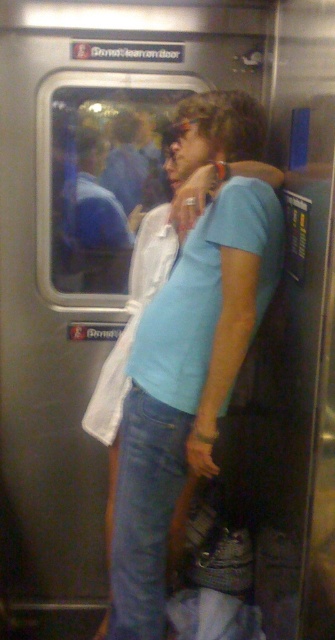
Question: Does light blue t-shirt at center lie behind blue shirt at center?

Choices:
 (A) no
 (B) yes

Answer: (A)

Question: Can you confirm if light blue t-shirt at center is smaller than blue shirt at center?

Choices:
 (A) yes
 (B) no

Answer: (B)

Question: Does light blue t-shirt at center have a larger size compared to blue shirt at center?

Choices:
 (A) yes
 (B) no

Answer: (A)

Question: Which point appears farthest from the camera in this image?

Choices:
 (A) (213, 132)
 (B) (98, 147)

Answer: (B)